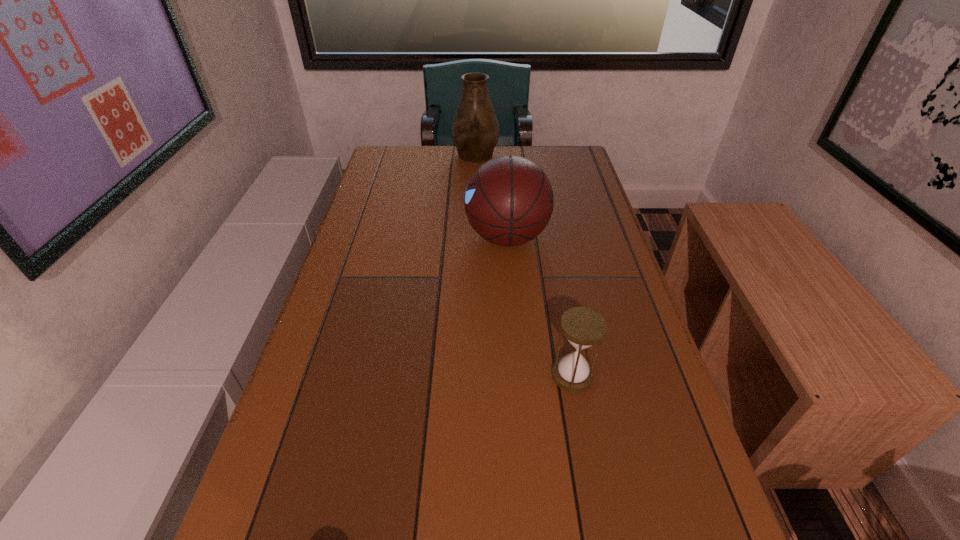
The height and width of the screenshot is (540, 960). Identify the location of pitcher. (475, 130).

Locate an element on the screen. the farthest object is located at coordinates (475, 130).

Where is `basketball`? basketball is located at coordinates point(509,200).

The image size is (960, 540). Identify the location of the second nearest object. (509, 200).

At what (x,y) coordinates should I click in order to perform the action: click on the nearest object. Please return your answer as a coordinate pair (x, y). This screenshot has height=540, width=960. Looking at the image, I should click on (583, 327).

This screenshot has width=960, height=540. What are the coordinates of `the shortest object` in the screenshot? It's located at (583, 327).

Locate an element on the screen. This screenshot has width=960, height=540. free space located 0.350m on the handle side of the farthest object is located at coordinates (474, 228).

The height and width of the screenshot is (540, 960). I want to click on free space located on the back of the second tallest object, so click(502, 167).

Find the location of a particular element. This screenshot has height=540, width=960. vacant area located on the back of the hourglass is located at coordinates (561, 311).

At what (x,y) coordinates should I click in order to perform the action: click on object present at the far edge. Please return your answer as a coordinate pair (x, y). The height and width of the screenshot is (540, 960). Looking at the image, I should click on (475, 130).